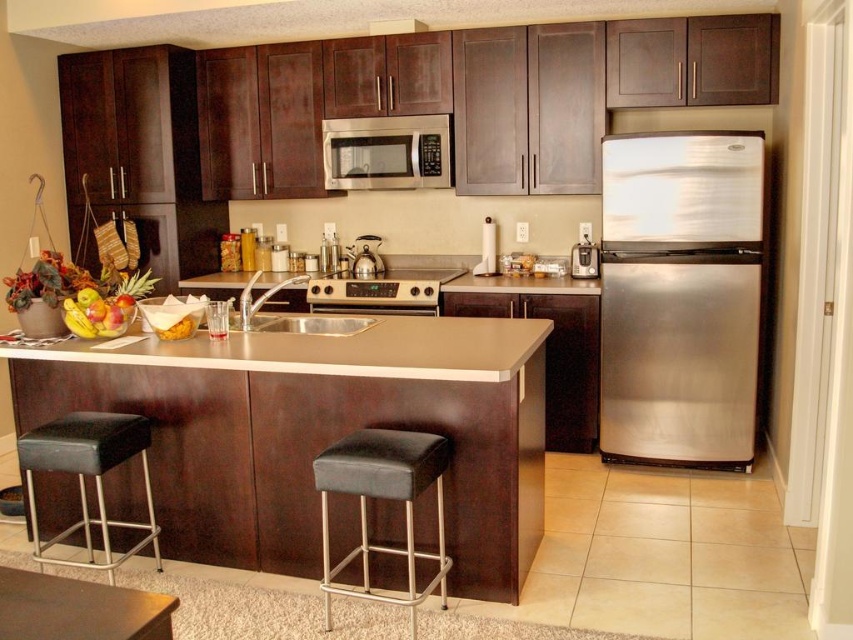
Is point (247, 356) in front of point (424, 451)?

No, (247, 356) is behind (424, 451).

Can you confirm if matte brown counter at center is bigger than black leather bar stool at center?

Correct, matte brown counter at center is larger in size than black leather bar stool at center.

Identify the location of matte brown counter at center. (318, 433).

Who is lower down, stainless steel refrigerator at right or satin gold oven at center?

stainless steel refrigerator at right is below.

Image resolution: width=853 pixels, height=640 pixels. What do you see at coordinates (680, 296) in the screenshot?
I see `stainless steel refrigerator at right` at bounding box center [680, 296].

You are a GUI agent. You are given a task and a screenshot of the screen. Output one action in this format:
    pyautogui.click(x=<x>, y=<y>)
    Task: Click on the stainless steel refrigerator at right
    This screenshot has height=640, width=853.
    Given the screenshot: What is the action you would take?
    680,296

Is the position of stainless steel refrigerator at right more distant than that of stainless steel microwave at center?

No, it is in front of stainless steel microwave at center.

Who is more distant from viewer, (612,445) or (383,129)?

The point (383,129) is behind.

The width and height of the screenshot is (853, 640). Identify the location of stainless steel refrigerator at right. (680, 296).